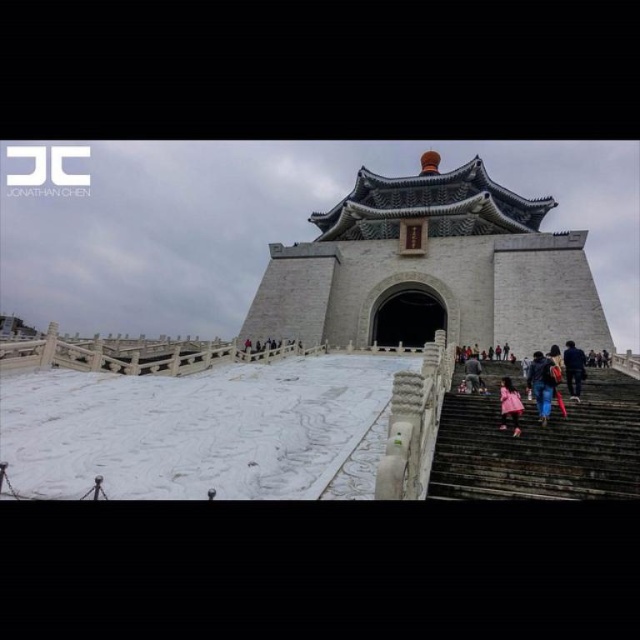
Question: Is dark blue jeans at center smaller than pink fabric at lower center?

Choices:
 (A) yes
 (B) no

Answer: (B)

Question: Does white stone tower at center have a smaller size compared to dark blue jeans at lower right?

Choices:
 (A) no
 (B) yes

Answer: (A)

Question: Does dark blue jeans at lower right come in front of pink fabric at lower center?

Choices:
 (A) yes
 (B) no

Answer: (A)

Question: Which of the following is the farthest from the observer?

Choices:
 (A) (477, 368)
 (B) (576, 419)

Answer: (A)

Question: Which point appears closest to the camera in this image?

Choices:
 (A) (484, 296)
 (B) (428, 496)
 (C) (568, 387)

Answer: (B)

Question: Which of the following is the closest to the observer?

Choices:
 (A) dark blue jeans at lower right
 (B) pink fabric at lower center
 (C) stone stairs at right
 (D) white stone tower at center

Answer: (C)